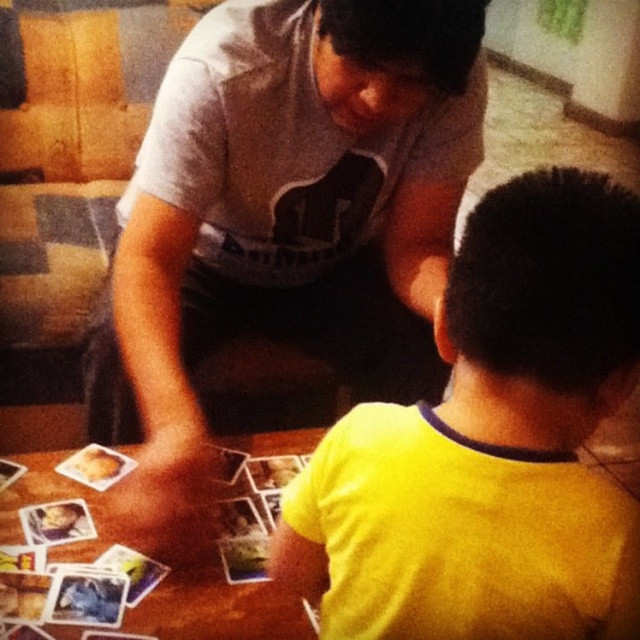
You are standing at the center of the table and want to place a new card exactly at the position of the yellow matte shirt at lower right. What are the coordinates where you should place the new card?

The coordinates for the position of the yellow matte shirt at lower right are 0.694 in the x axis and 0.767 in the y axis, so you should place the new card at those coordinates.

You are a photographer trying to capture a closeup of the wooden table at lower left without including the gray cotton shirt at upper center in the frame. Based on their positions, is this possible?

The gray cotton shirt at upper center is positioned on the right side of wooden table at lower left. Since the shirt is on the right side of the table, you can position the camera to the left side of the wooden table at lower left to avoid including the gray cotton shirt at upper center in the frame.

In the scene shown: You are sitting at the table and want to pass a card to the gray cotton shirt at upper center and the yellow matte shirt at lower right. Which person will you hand the card to first to ensure it reaches them without needing to move around the table?

You should hand the card to the gray cotton shirt at upper center first because they are closer to you, as the gray cotton shirt at upper center is closer than the yellow matte shirt at lower right.